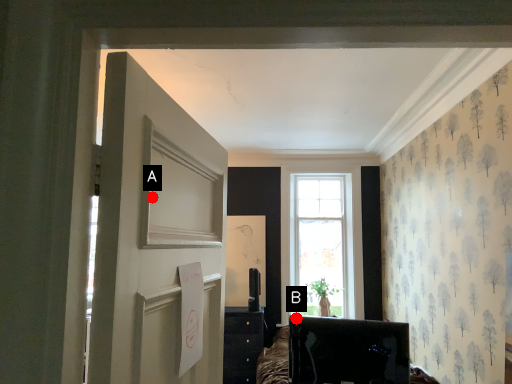
Question: Two points are circled on the image, labeled by A and B beside each circle. Which point is further to the camera?

Choices:
 (A) A is further
 (B) B is further

Answer: (B)